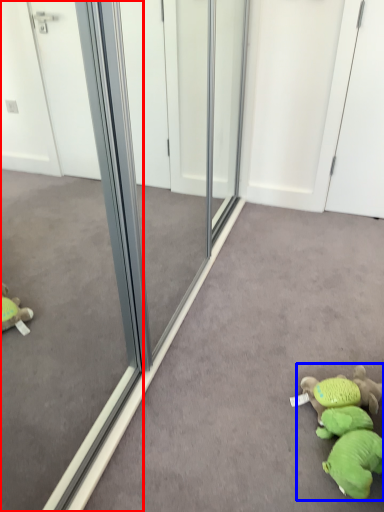
Question: Which of the following is the farthest to the observer, glass door (highlighted by a red box) or toy (highlighted by a blue box)?

Choices:
 (A) glass door
 (B) toy

Answer: (B)